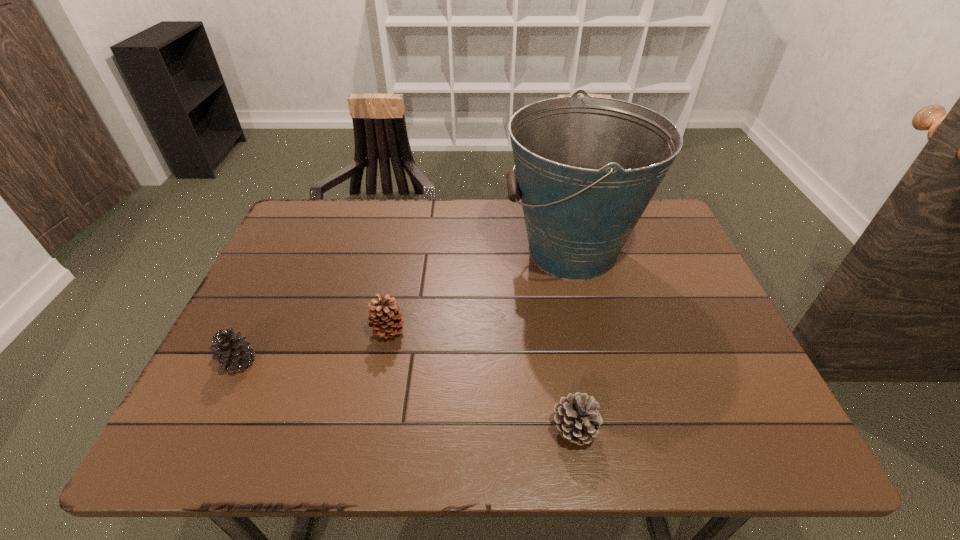
At what (x,y) coordinates should I click in order to perform the action: click on the tallest object. Please return your answer as a coordinate pair (x, y). Looking at the image, I should click on (586, 168).

In order to click on bucket in this screenshot , I will do `click(586, 168)`.

Locate an element on the screen. The width and height of the screenshot is (960, 540). the third nearest object is located at coordinates (383, 318).

Identify the location of the second pinecone from right to left. (383, 318).

Where is `the second nearest object`? This screenshot has width=960, height=540. the second nearest object is located at coordinates (233, 352).

The image size is (960, 540). I want to click on the leftmost object, so click(x=233, y=352).

The width and height of the screenshot is (960, 540). I want to click on the nearest pinecone, so [x=577, y=419].

The image size is (960, 540). What are the coordinates of `the nearest object` in the screenshot? It's located at (577, 419).

Where is `vacant space located 0.160m with the handle on opposite sides of the tallest object`? The width and height of the screenshot is (960, 540). vacant space located 0.160m with the handle on opposite sides of the tallest object is located at coordinates (445, 252).

What are the coordinates of `vacant space located with the handle on opposite sides of the tallest object` in the screenshot? It's located at (406, 252).